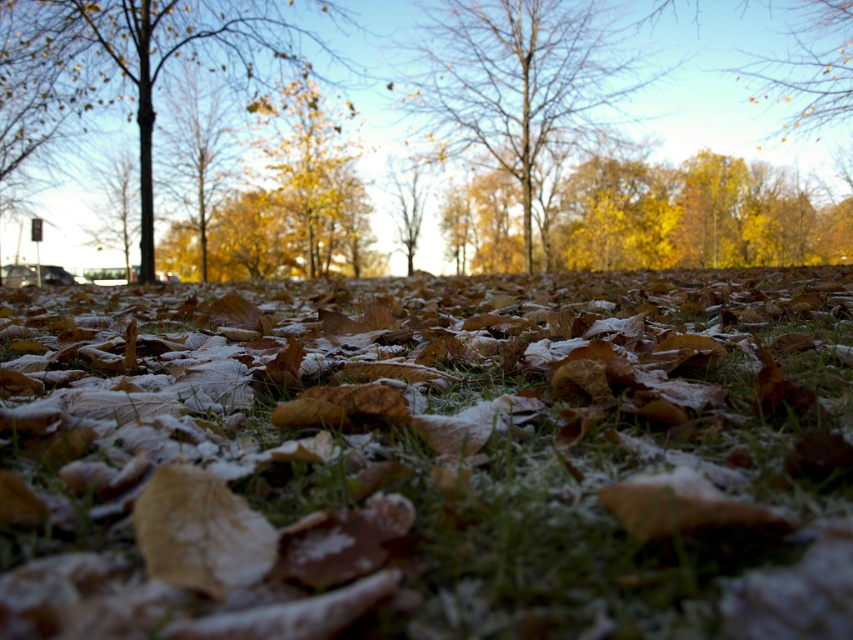
Which is behind, point (512, 504) or point (503, 76)?

The point (503, 76) is more distant.

Is frosted green grass at center taller than bare branches at center?

No.

Is point (735, 461) farther from viewer compared to point (437, 24)?

No, it is in front of (437, 24).

The image size is (853, 640). I want to click on frosted green grass at center, so click(x=431, y=458).

How distant is brown wood tree at left from yellow matte leaves at upper center?

They are 17.39 meters apart.

Who is more forward, (x=115, y=51) or (x=840, y=45)?

Point (x=115, y=51)

Between point (281, 38) and point (784, 64), which one is positioned behind?

Point (784, 64)

Identify the location of brown wood tree at left. (115, 67).

From the picture: Can you confirm if frosted green grass at center is positioned above yellow matte leaves at upper center?

Incorrect, frosted green grass at center is not positioned above yellow matte leaves at upper center.

How distant is frosted green grass at center from yellow matte leaves at upper center?

frosted green grass at center is 68.47 feet away from yellow matte leaves at upper center.

Who is more forward, (839, 570) or (833, 84)?

Point (839, 570)

Identify the location of frosted green grass at center. The height and width of the screenshot is (640, 853). (431, 458).